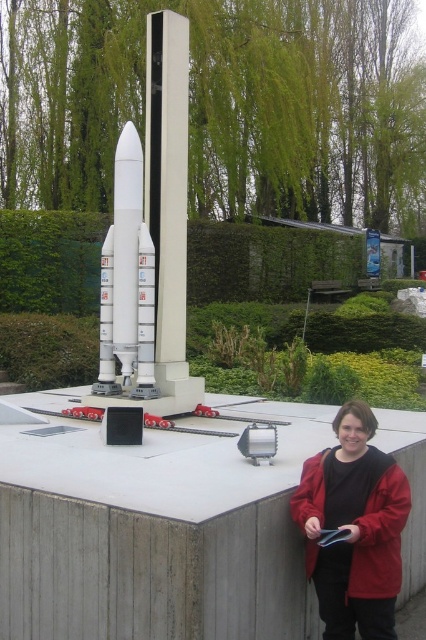
What object is located at the coordinates point (127,282) in the image?

The point (127,282) indicates the white matte rocket at center.

You are standing in front of the rocket model and looking at the two points marked in the image. Which point, point (124,340) or point (321,547), is closer to you?

Point (124,340) is further to the camera than point (321,547), so the point closer to you is point (321,547).